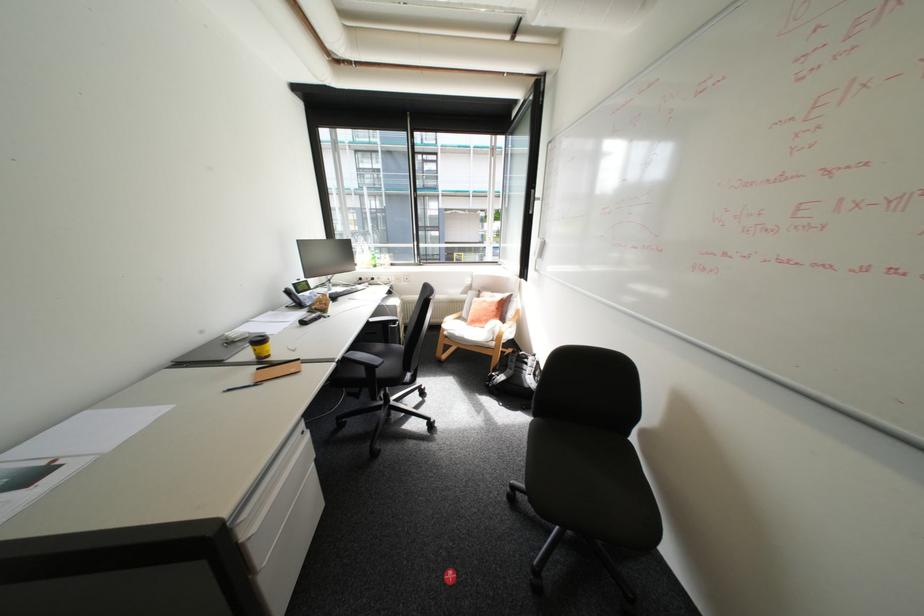
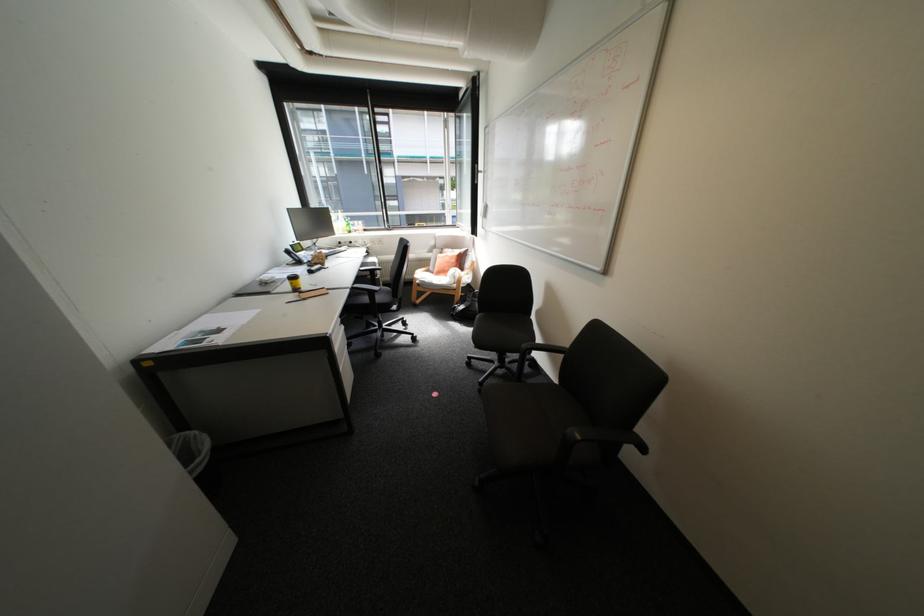
Where in the second image is the point corresponding to point (256, 353) from the first image?

(296, 286)